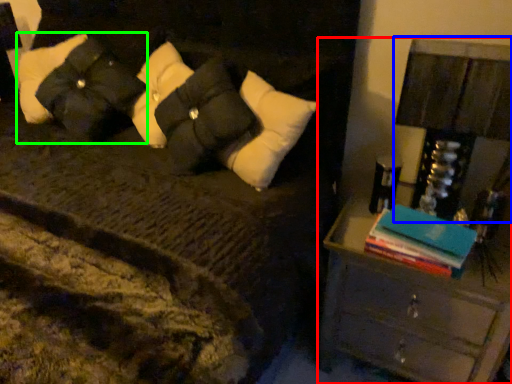
Question: Considering the real-world distances, which object is closest to nightstand (highlighted by a red box)? bedside lamp (highlighted by a blue box) or pillow (highlighted by a green box).

Choices:
 (A) bedside lamp
 (B) pillow

Answer: (A)